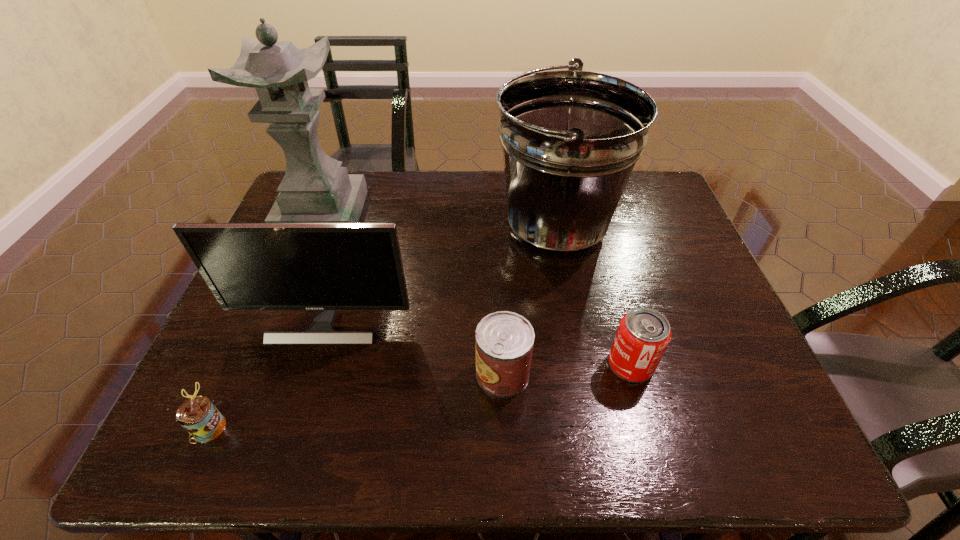
Locate an element on the screen. The height and width of the screenshot is (540, 960). vacant space that satisfies the following two spatial constraints: 1. at the front opening of the sculpture; 2. on the left side of the second can from left to right is located at coordinates (259, 374).

Locate an element on the screen. This screenshot has width=960, height=540. vacant space that satisfies the following two spatial constraints: 1. on the screen side of the rightmost can; 2. on the left side of the third tallest object is located at coordinates (311, 364).

This screenshot has height=540, width=960. What are the coordinates of `vacant space that satisfies the following two spatial constraints: 1. on the back side of the nearest can; 2. on the left side of the fifth shortest object` in the screenshot? It's located at (299, 227).

Find the location of `free location that satisfies the following two spatial constraints: 1. on the back side of the rightmost can; 2. on the right side of the second can from left to right`. free location that satisfies the following two spatial constraints: 1. on the back side of the rightmost can; 2. on the right side of the second can from left to right is located at coordinates (502, 364).

Identify the location of free location that satisfies the following two spatial constraints: 1. on the back side of the second can from left to right; 2. on the left side of the rightmost can. (502, 364).

Locate an element on the screen. free space that satisfies the following two spatial constraints: 1. at the front opening of the second tallest object; 2. on the left side of the sculpture is located at coordinates (318, 227).